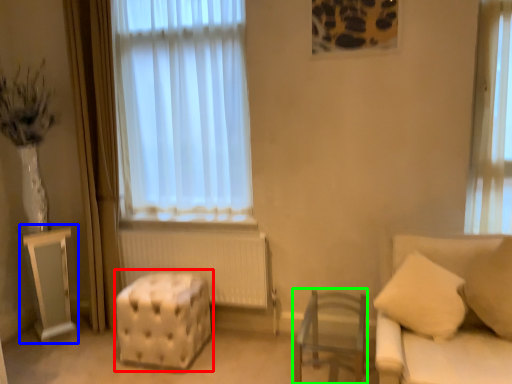
Question: Estimate the real-world distances between objects in this image. Which object is closer to stool (highlighted by a red box), table (highlighted by a blue box) or furniture (highlighted by a green box)?

Choices:
 (A) table
 (B) furniture

Answer: (A)